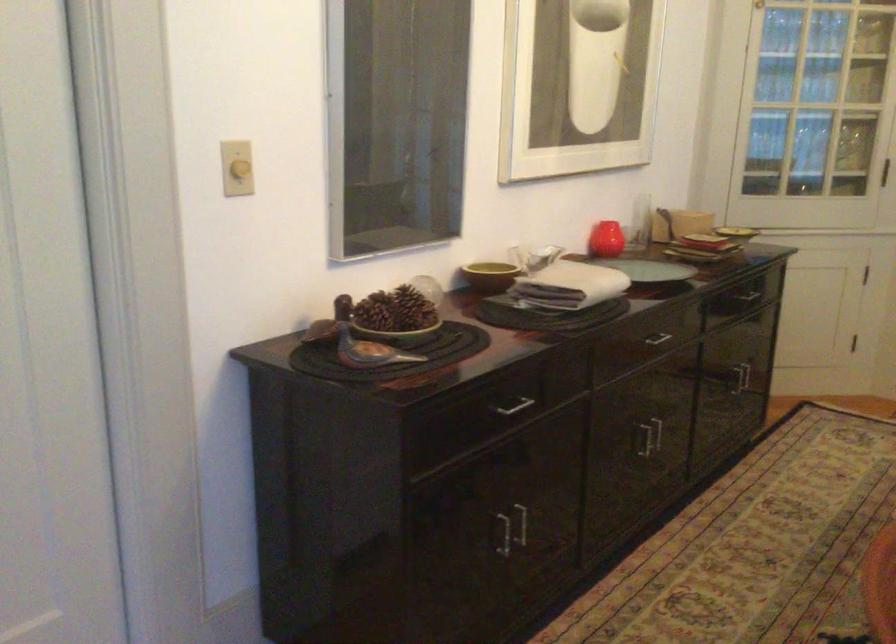
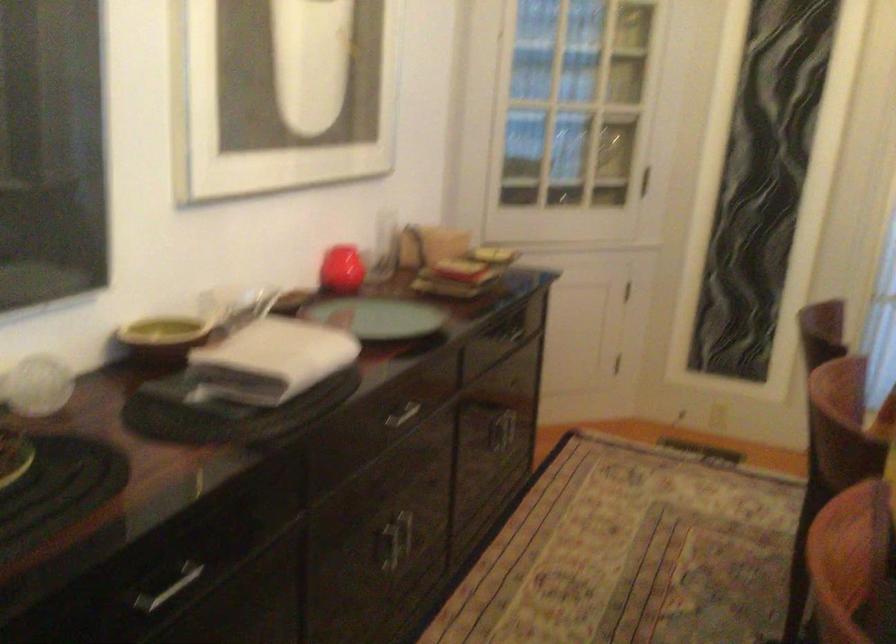
Question: The first image is from the beginning of the video and the second image is from the end. How did the camera likely rotate when shooting the video?

Choices:
 (A) Left
 (B) Right
 (C) Up
 (D) Down

Answer: (B)